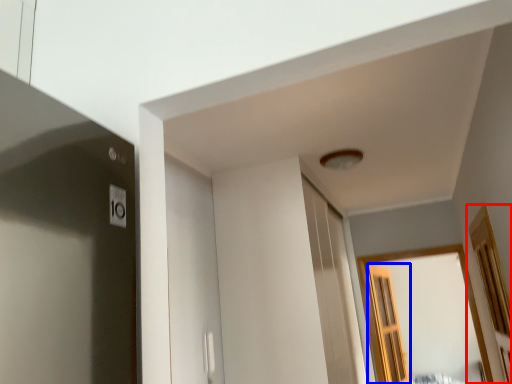
Question: Which object is further to the camera taking this photo, window (highlighted by a red box) or screen door (highlighted by a blue box)?

Choices:
 (A) window
 (B) screen door

Answer: (B)